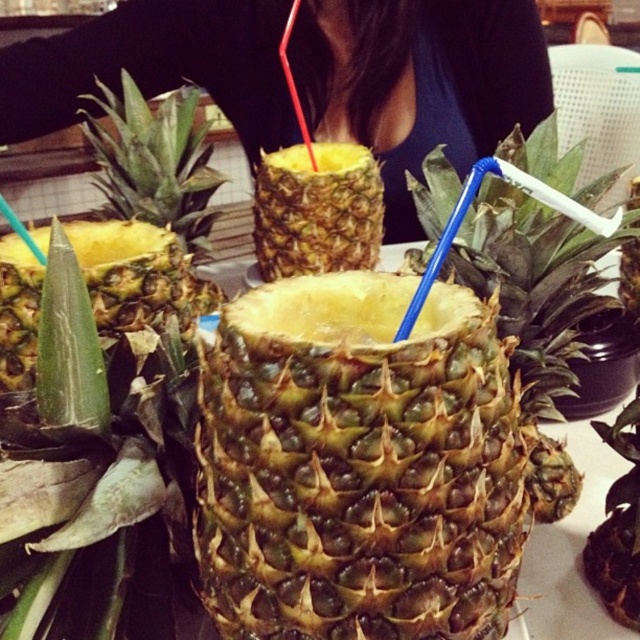
You are holding a camera and want to take a photo of the pineapple drinks. The camera has a focus range of 10 to 12 inches. Is the point at coordinates point [424,480] within the camera focus range?

The point point [424,480] is 11.60 inches away from the viewer, which falls within the camera focus range of 10 to 12 inches. Therefore, the camera can focus on this point.

You are a delivery person who needs to place a package on the table where the green textured pineapple at center and the black fabric at center are located. The package is 30 inches long. Can you place the package between them without it overlapping either object?

The green textured pineapple at center is 31.81 inches away from the black fabric at center. Since the package is only 30 inches long, it can fit between them without overlapping either object.